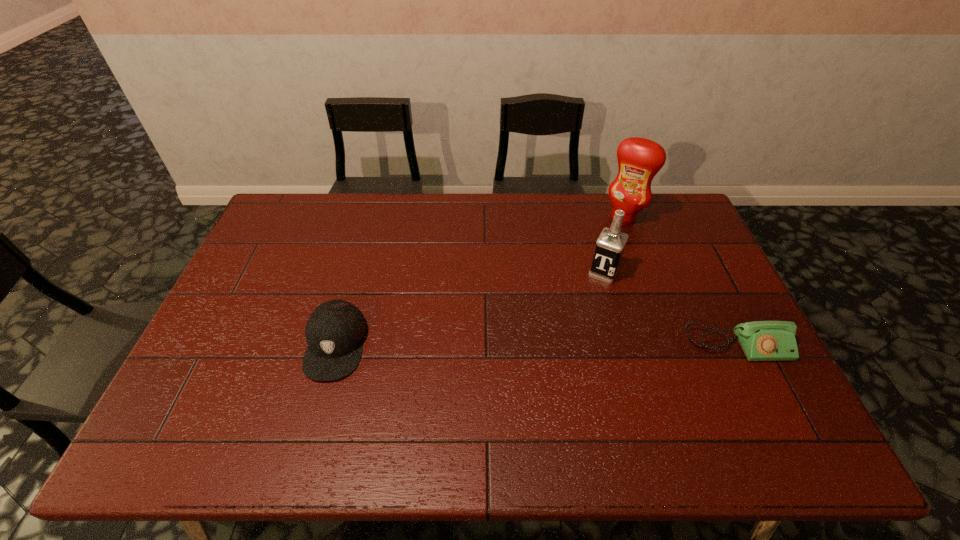
Image resolution: width=960 pixels, height=540 pixels. I want to click on free space on the desktop that is between the third tallest object and the shortest object and is positioned on the front label of the third nearest object, so click(x=566, y=345).

This screenshot has height=540, width=960. In order to click on free space on the desktop that is between the cap and the shortest object and is positioned on the label side of the tallest object in this screenshot , I will do `click(540, 345)`.